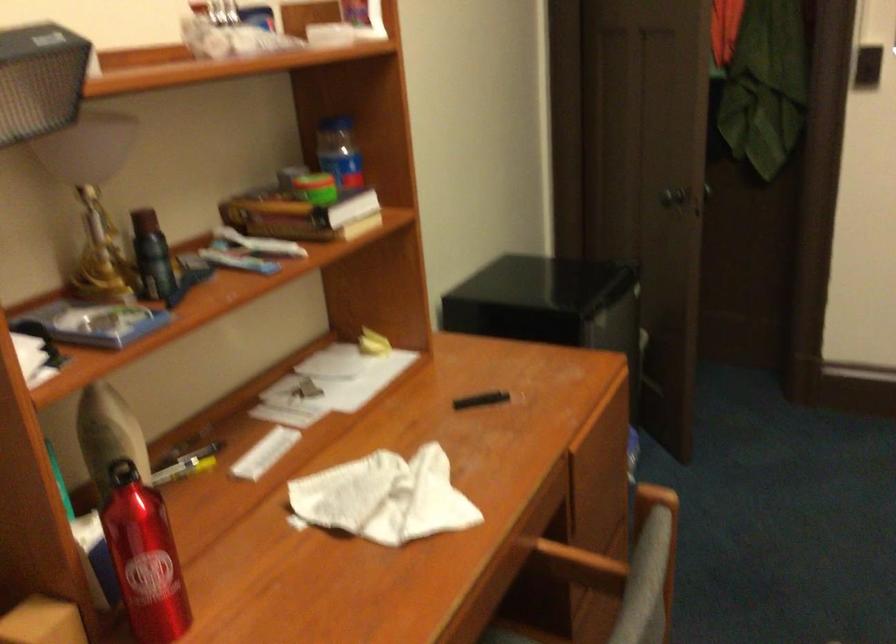
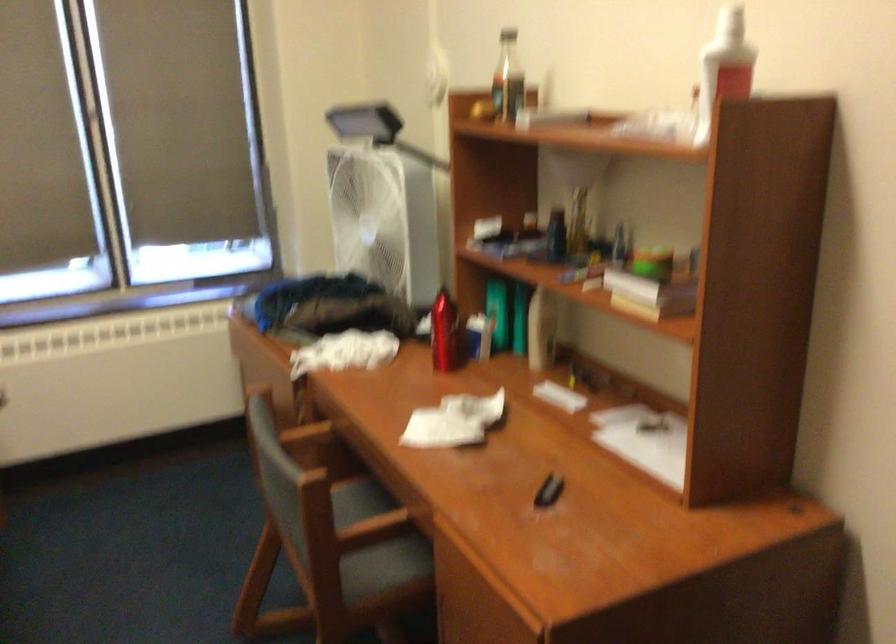
Question: I am providing you with two images of the same scene from different viewpoints. Which of the following objects are not visible in image2?

Choices:
 (A) red water bottle
 (B) chair armrest
 (C) chair sitting surface
 (D) none of these

Answer: (D)